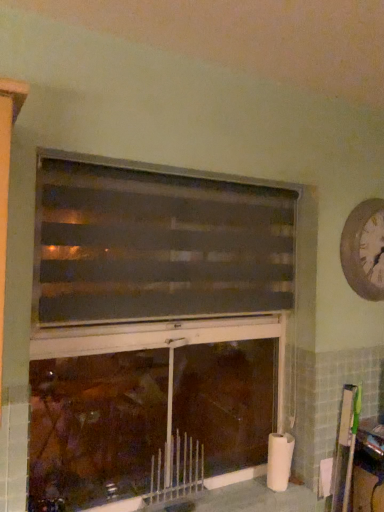
Question: Based on their sizes in the image, would you say white textured clock at upper right is bigger or smaller than metallic silver radiator at lower center?

Choices:
 (A) small
 (B) big

Answer: (B)

Question: Is white textured clock at upper right inside or outside of metallic silver radiator at lower center?

Choices:
 (A) outside
 (B) inside

Answer: (A)

Question: Considering the real-world distances, which object is closest to the wooden bulletin board at right?

Choices:
 (A) matte brown fireplace at center
 (B) white textured clock at upper right
 (C) dark brown textured blinds at center
 (D) metallic silver radiator at lower center

Answer: (B)

Question: Based on their relative distances, which object is nearer to the wooden bulletin board at right?

Choices:
 (A) matte brown fireplace at center
 (B) dark brown textured blinds at center
 (C) metallic silver radiator at lower center
 (D) white textured clock at upper right

Answer: (D)